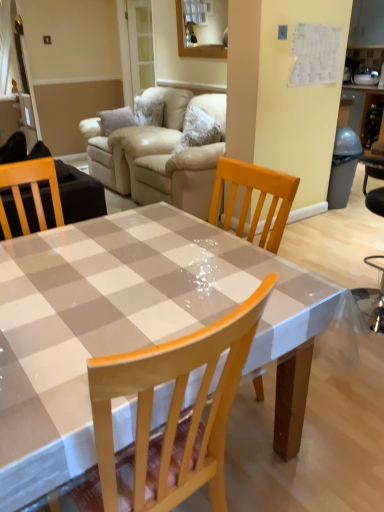
Question: In the image, is beige leather couch at upper center positioned in front of or behind clear plastic table at center?

Choices:
 (A) behind
 (B) front

Answer: (A)

Question: Is beige leather couch at upper center bigger or smaller than clear plastic table at center?

Choices:
 (A) small
 (B) big

Answer: (B)

Question: From the image's perspective, is beige leather couch at upper center above or below clear plastic table at center?

Choices:
 (A) below
 (B) above

Answer: (B)

Question: From the image's perspective, is clear plastic table at center positioned above or below beige leather couch at upper center?

Choices:
 (A) above
 (B) below

Answer: (B)

Question: Is clear plastic table at center to the left or to the right of beige leather couch at upper center in the image?

Choices:
 (A) left
 (B) right

Answer: (B)

Question: Which is correct: clear plastic table at center is inside beige leather couch at upper center, or outside of it?

Choices:
 (A) outside
 (B) inside

Answer: (A)

Question: Does point (56, 483) appear closer or farther from the camera than point (183, 197)?

Choices:
 (A) closer
 (B) farther

Answer: (A)